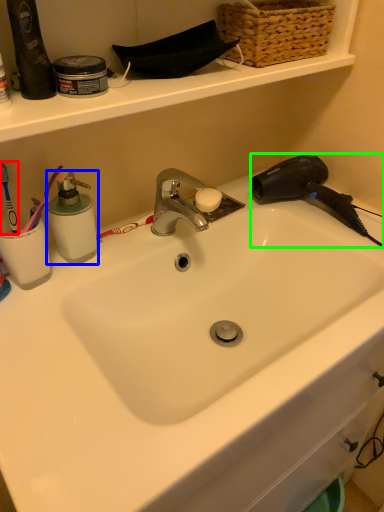
Question: Which object is positioned closest to brush (highlighted by a red box)? Select from soap dispenser (highlighted by a blue box) and hair drier (highlighted by a green box).

Choices:
 (A) soap dispenser
 (B) hair drier

Answer: (A)